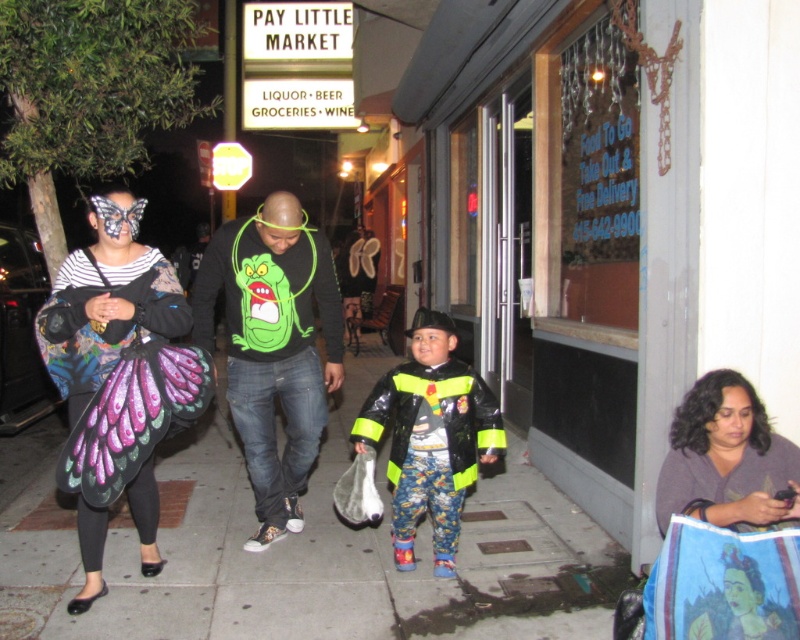
Question: Which point is closer to the camera?

Choices:
 (A) (720, 371)
 (B) (401, 499)
 (C) (52, 305)
 (D) (122, 541)

Answer: (A)

Question: Which object is closer to the camera taking this photo?

Choices:
 (A) butterfly wing costume at left
 (B) gray soft sweater at lower right

Answer: (B)

Question: Is black matte sweatshirt at center below smooth skin face at center?

Choices:
 (A) yes
 (B) no

Answer: (B)

Question: Based on their relative distances, which object is nearer to the black matte sweatshirt at center?

Choices:
 (A) smooth concrete sidewalk at center
 (B) smooth skin face at lower right
 (C) matte black butterfly wings at left
 (D) reflective black jacket at center

Answer: (D)

Question: Can you confirm if smooth concrete sidewalk at center is positioned above reflective black jacket at center?

Choices:
 (A) yes
 (B) no

Answer: (B)

Question: Is smooth skin face at center thinner than green matte/soft plastic face at center?

Choices:
 (A) yes
 (B) no

Answer: (A)